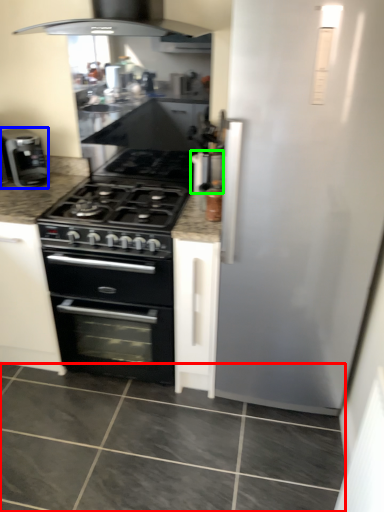
Question: Estimate the real-world distances between objects in this image. Which object is closer to granite (highlighted by a red box), kitchen appliance (highlighted by a blue box) or appliance (highlighted by a green box)?

Choices:
 (A) kitchen appliance
 (B) appliance

Answer: (B)